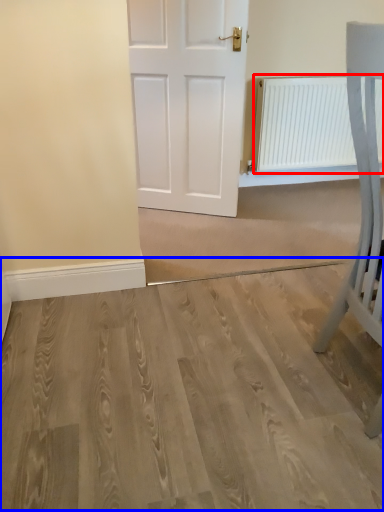
Question: Among these objects, which one is farthest to the camera, radiator (highlighted by a red box) or plain (highlighted by a blue box)?

Choices:
 (A) radiator
 (B) plain

Answer: (A)